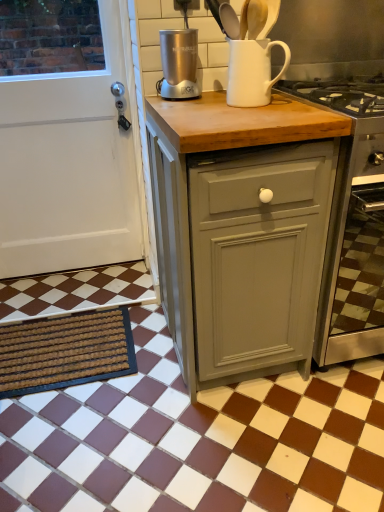
Question: Considering the positions of point (236, 79) and point (269, 352), is point (236, 79) closer or farther from the camera than point (269, 352)?

Choices:
 (A) closer
 (B) farther

Answer: (A)

Question: Is white matte jug at upper center inside the boundaries of matte gray cabinet at center, or outside?

Choices:
 (A) outside
 (B) inside

Answer: (A)

Question: Which is farther from the satin silver blender at center?

Choices:
 (A) matte gray cabinet at center
 (B) white matte jug at upper center
 (C) brown textured mat at lower left
 (D) white matte door at left
 (E) brown/white checkered tile at lower center

Answer: (E)

Question: Which is farther from the brown/white checkered tile at lower center?

Choices:
 (A) satin silver blender at center
 (B) white matte door at left
 (C) white matte jug at upper center
 (D) matte gray cabinet at center
 (E) brown textured mat at lower left

Answer: (A)